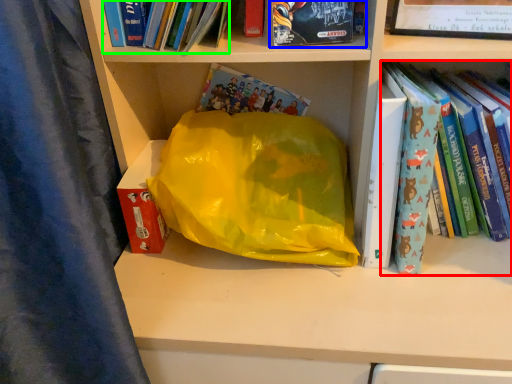
Question: Considering the real-world distances, which object is closest to book (highlighted by a red box)? book (highlighted by a blue box) or book (highlighted by a green box).

Choices:
 (A) book
 (B) book

Answer: (A)